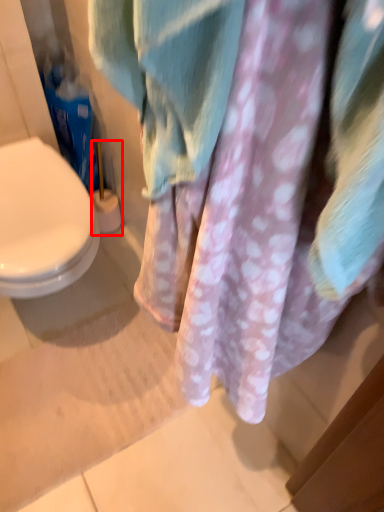
Question: In this image, where is brush (annotated by the red box) located relative to laundry?

Choices:
 (A) left
 (B) right

Answer: (A)